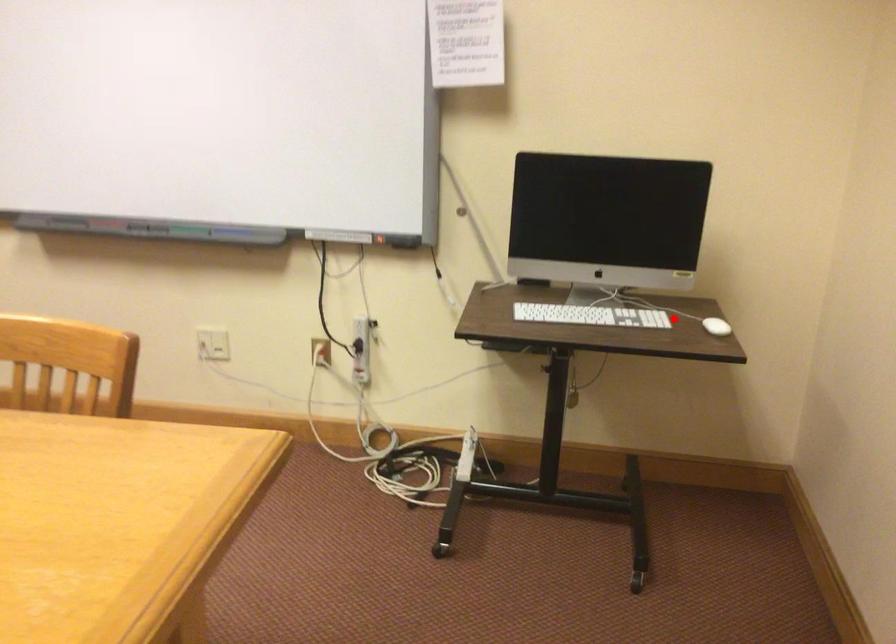
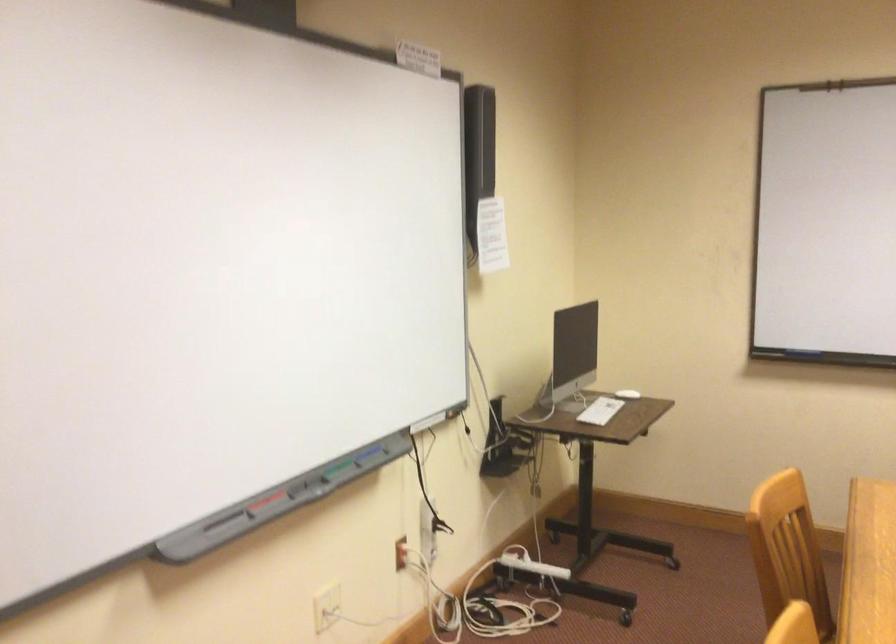
Question: I am providing you with two images of the same scene from different viewpoints. Image1 has a red point marked. In image2, the corresponding 3D location appears at what relative position? Reply with the corresponding letter.

Choices:
 (A) Closer
 (B) Farther

Answer: (B)